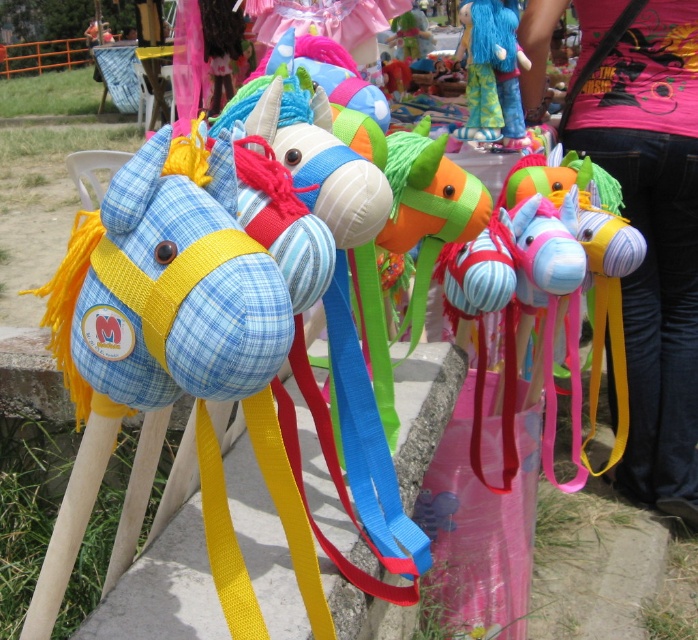
Question: Which point appears farthest from the camera in this image?

Choices:
 (A) (467, 61)
 (B) (671, 10)

Answer: (A)

Question: Is matte pink shirt at upper right further to camera compared to blue fabric doll at upper center?

Choices:
 (A) yes
 (B) no

Answer: (B)

Question: Which object is closer to the camera taking this photo?

Choices:
 (A) matte pink shirt at upper right
 (B) blue fabric doll at upper center

Answer: (A)

Question: Does matte pink shirt at upper right have a lesser width compared to blue fabric doll at upper center?

Choices:
 (A) yes
 (B) no

Answer: (B)

Question: Which point is farther to the camera?

Choices:
 (A) (484, 90)
 (B) (676, 378)

Answer: (B)

Question: Can you confirm if matte pink shirt at upper right is bigger than blue fabric doll at upper center?

Choices:
 (A) no
 (B) yes

Answer: (B)